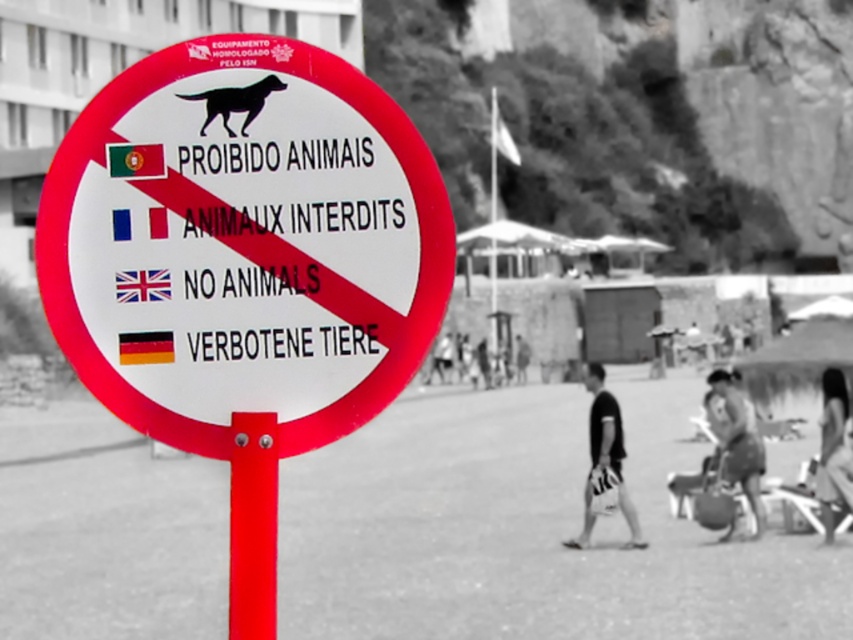
You are standing in front of the sign prohibiting animals and want to place a small sticker on the sign. You have two options for placement based on coordinates provided. The first option is at point (134, 294) and the second is at point (631, 538). Which point is closer to you so that the sticker is more visible?

Point (134, 294) is closer to the viewer than point (631, 538), so placing the sticker there will make it more visible.

You are a person wearing dark skin textured shorts at lower right and you see the sign in the image. What does the sign say?

The sign says PROIBIDO ANIMAIS, ANIMAX INTERDITS, NO ANIMALS, and VERBOTENE TIERE, indicating that animals are prohibited in the area.

You are a beachgoer looking at the sign prohibiting animals and wearing both dark skin textured shorts at lower right and smooth fabric shirt at lower right. Which piece of clothing is positioned more to the right?

The smooth fabric shirt at lower right is positioned more to the right than the dark skin textured shorts at lower right.